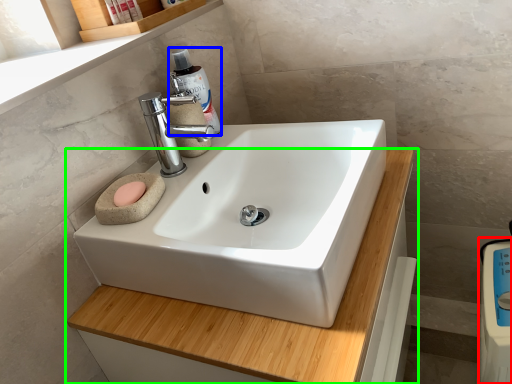
Question: Considering the real-world distances, which object is farthest from appliance (highlighted by a red box)? cleaning product (highlighted by a blue box) or bathroom cabinet (highlighted by a green box)?

Choices:
 (A) cleaning product
 (B) bathroom cabinet

Answer: (A)